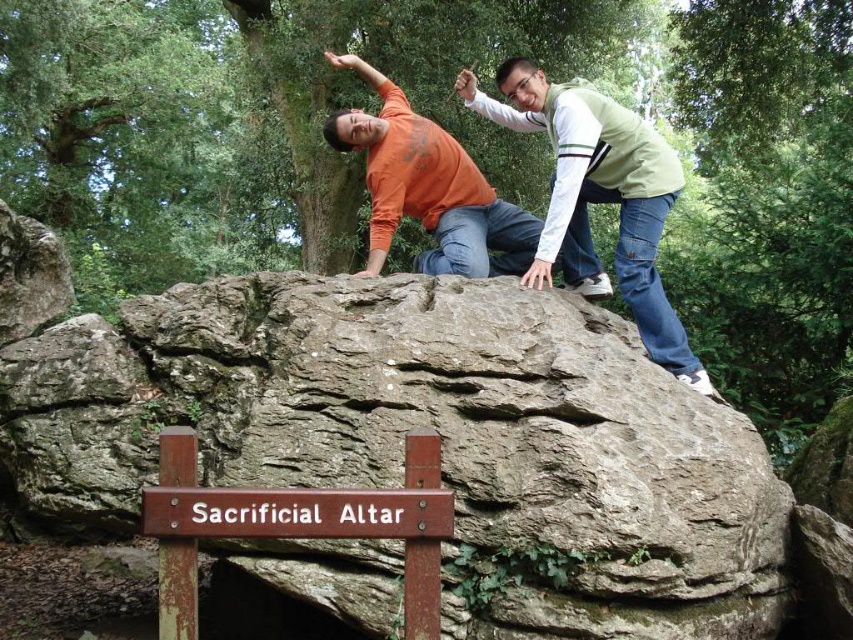
Question: Does brown wooden sign at lower center lie in front of orange matte shirt at upper center?

Choices:
 (A) no
 (B) yes

Answer: (B)

Question: Is green textured vest at upper right positioned before brown wooden sign at lower center?

Choices:
 (A) no
 (B) yes

Answer: (A)

Question: Which is nearer to the orange matte shirt at upper center?

Choices:
 (A) green textured vest at upper right
 (B) brown wooden sign at lower center

Answer: (A)

Question: Which object is the farthest from the brown wooden sign at lower center?

Choices:
 (A) orange matte shirt at upper center
 (B) green textured vest at upper right

Answer: (A)

Question: Among these objects, which one is nearest to the camera?

Choices:
 (A) green textured vest at upper right
 (B) brown wooden sign at lower center
 (C) orange matte shirt at upper center

Answer: (B)

Question: Considering the relative positions of brown wooden sign at lower center and orange matte shirt at upper center in the image provided, where is brown wooden sign at lower center located with respect to orange matte shirt at upper center?

Choices:
 (A) right
 (B) left

Answer: (A)